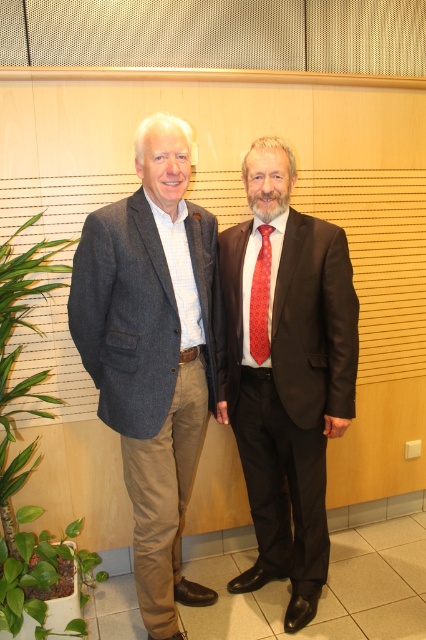
You are an event planner arranging seating for a meeting. You need to seat the dark brown suit at center and the gray woolen blazer at left. Which person should be seated closer to the front of the room to ensure both have equal visibility?

The dark brown suit at center should be seated closer to the front because it is much taller than the gray woolen blazer at left, ensuring both have equal visibility.